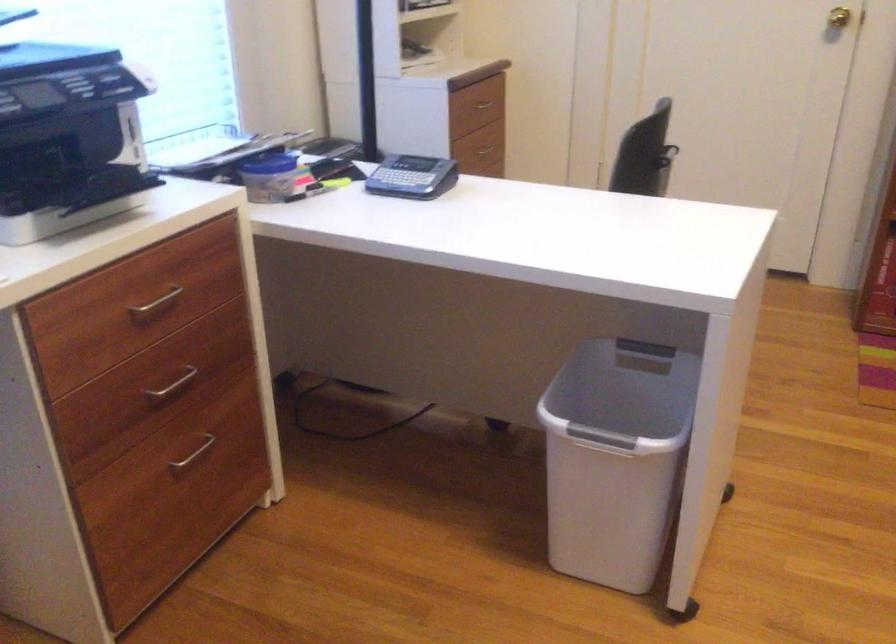
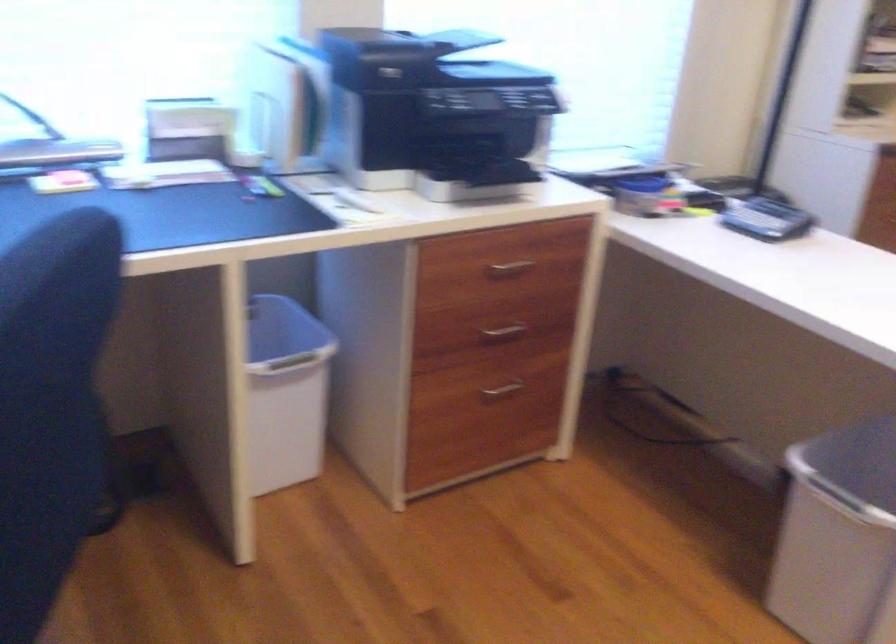
The point at (173, 386) is marked in the first image. Where is the corresponding point in the second image?

(503, 330)